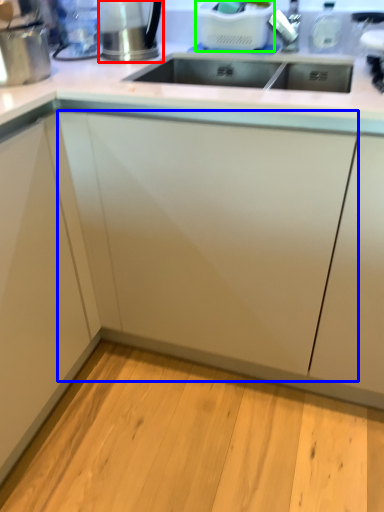
Question: Based on their relative distances, which object is farther from appliance (highlighted by a red box)? Choose from cabinetry (highlighted by a blue box) and appliance (highlighted by a green box).

Choices:
 (A) cabinetry
 (B) appliance

Answer: (A)